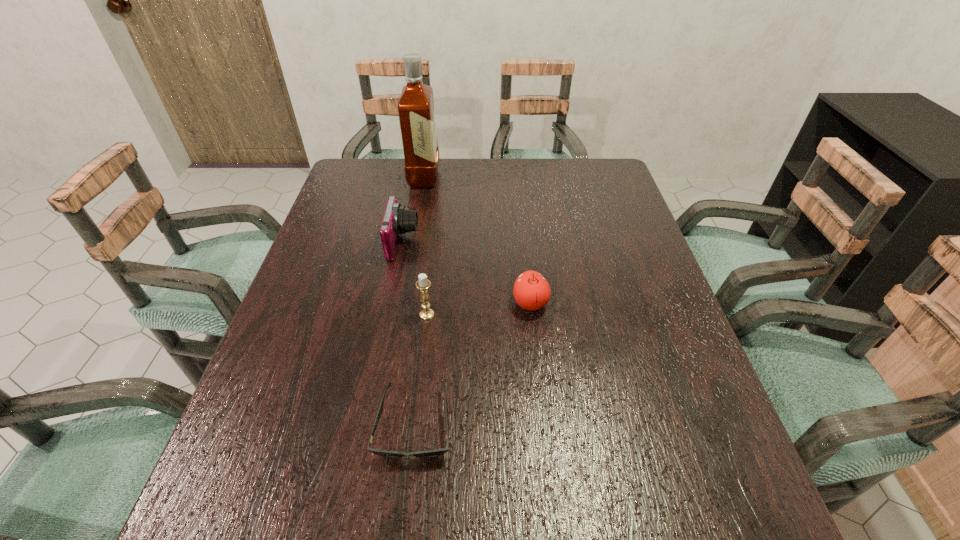
Locate an element on the screen. This screenshot has width=960, height=540. vacant space that satisfies the following two spatial constraints: 1. on the front label of the apple; 2. on the left side of the farthest object is located at coordinates (402, 303).

Image resolution: width=960 pixels, height=540 pixels. Identify the location of free space that satisfies the following two spatial constraints: 1. on the front-facing side of the fourth nearest object; 2. on the left side of the candle holder. (389, 314).

Where is `free space that satisfies the following two spatial constraints: 1. on the front-facing side of the fourth nearest object; 2. on the left side of the rightmost object`? free space that satisfies the following two spatial constraints: 1. on the front-facing side of the fourth nearest object; 2. on the left side of the rightmost object is located at coordinates (392, 303).

Where is `blank area in the image that satisfies the following two spatial constraints: 1. on the back side of the apple; 2. on the front-facing side of the fourth nearest object`? blank area in the image that satisfies the following two spatial constraints: 1. on the back side of the apple; 2. on the front-facing side of the fourth nearest object is located at coordinates (524, 243).